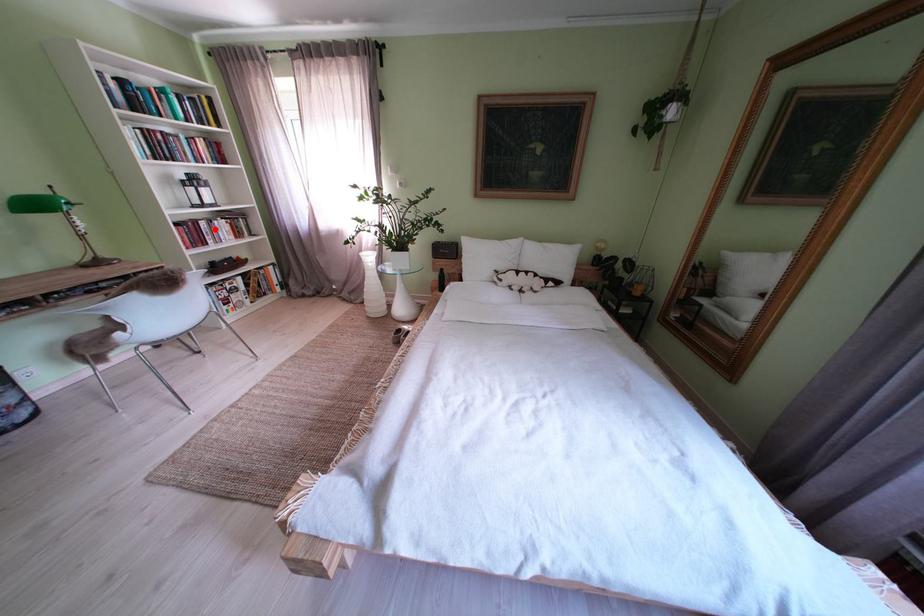
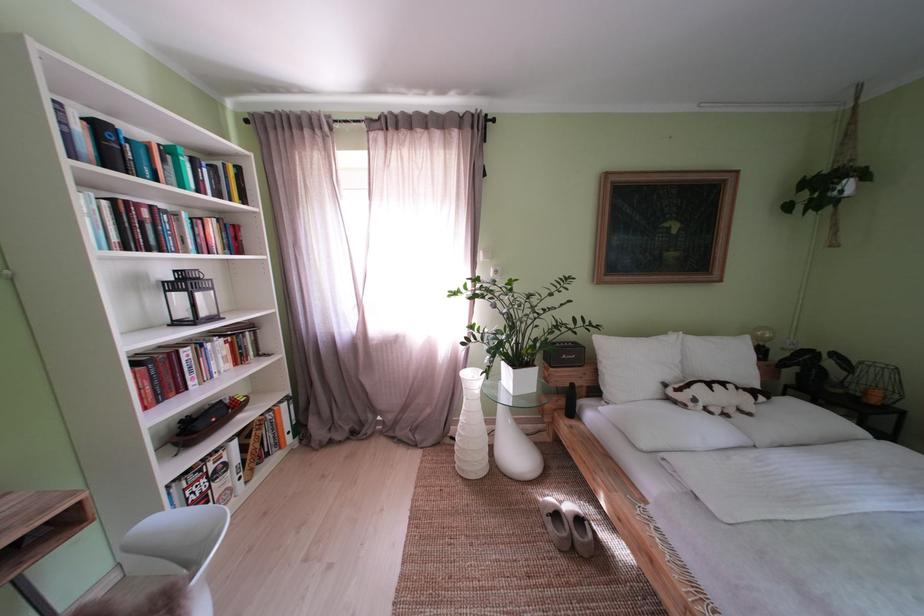
In the second image, find the point that corresponds to the highlighted location in the first image.

(199, 359)